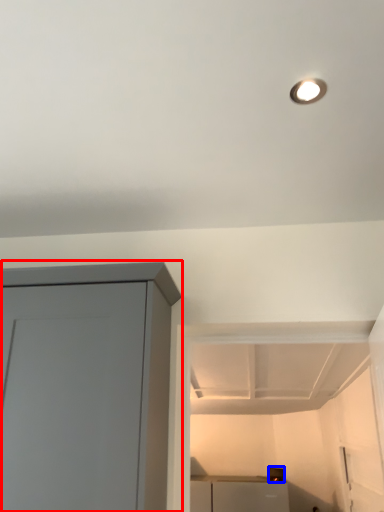
Question: Among these objects, which one is farthest to the camera, cupboard (highlighted by a red box) or appliance (highlighted by a blue box)?

Choices:
 (A) cupboard
 (B) appliance

Answer: (B)